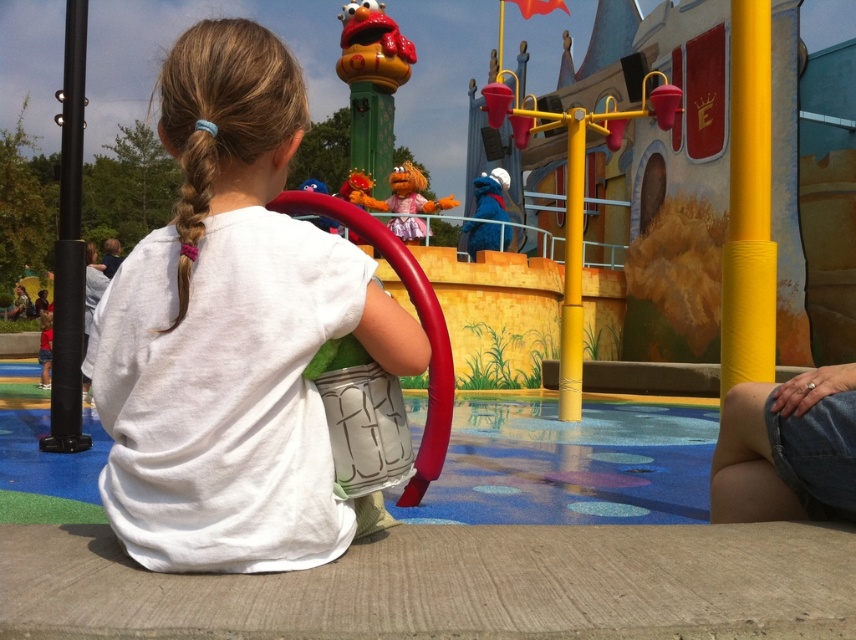
Question: Which object appears closest to the camera in this image?

Choices:
 (A) pink plush puppet at center
 (B) blonde hair at upper left
 (C) rubberized red ring at upper center

Answer: (B)

Question: Is blonde hair at upper left to the right of matte orange plush at upper center from the viewer's perspective?

Choices:
 (A) yes
 (B) no

Answer: (B)

Question: Which object is closer to the camera taking this photo?

Choices:
 (A) rubberized red ring at upper center
 (B) denim shorts at lower right
 (C) blonde hair at upper left

Answer: (C)

Question: Is white cotton shirt at center to the left of pink plush puppet at center from the viewer's perspective?

Choices:
 (A) yes
 (B) no

Answer: (A)

Question: Estimate the real-world distances between objects in this image. Which object is closer to the denim shorts at lower right?

Choices:
 (A) blue plush toy at upper center
 (B) pink plush puppet at center

Answer: (A)

Question: Does blonde hair at upper left appear on the right side of matte orange plush at upper center?

Choices:
 (A) yes
 (B) no

Answer: (B)